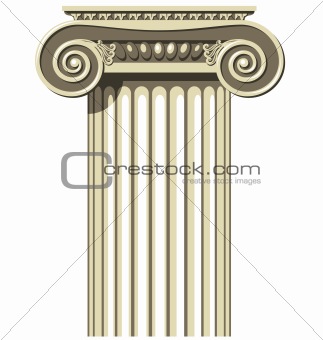
Find the location of a particular element. The image size is (323, 340). top front right corner of column is located at coordinates (255, 7).